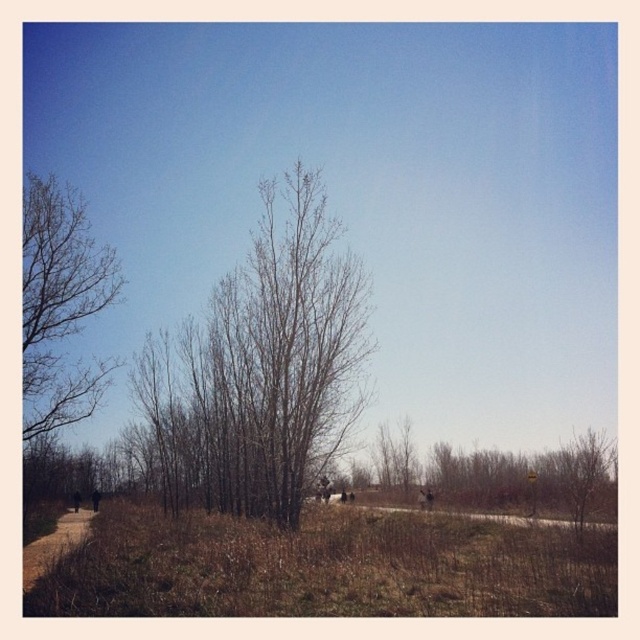
Which is more to the left, dark clothing figure at lower left or dark brown fur at center?

dark brown fur at center

Between point (92, 509) and point (76, 493), which one is positioned in front?

Point (92, 509) is in front.

What do you see at coordinates (96, 499) in the screenshot? The height and width of the screenshot is (640, 640). I see `dark clothing figure at lower left` at bounding box center [96, 499].

At what (x,y) coordinates should I click in order to perform the action: click on dark clothing figure at lower left. Please return your answer as a coordinate pair (x, y). The width and height of the screenshot is (640, 640). Looking at the image, I should click on (96, 499).

Which of these two, bare branches at left or dark brown fur at center, stands taller?

bare branches at left

Is bare branches at left below dark brown fur at center?

No, bare branches at left is not below dark brown fur at center.

Which is behind, point (42, 284) or point (74, 504)?

Positioned behind is point (74, 504).

Find the location of a particular element. bare branches at left is located at coordinates (60, 305).

Is bare wood tree at center shorter than brown dirt path at lower left?

No, bare wood tree at center is not shorter than brown dirt path at lower left.

Does bare wood tree at center have a greater width compared to brown dirt path at lower left?

Yes.

You are a GUI agent. You are given a task and a screenshot of the screen. Output one action in this format:
    pyautogui.click(x=<x>, y=<y>)
    Task: Click on the bare wood tree at center
    
    Given the screenshot: What is the action you would take?
    pyautogui.click(x=262, y=368)